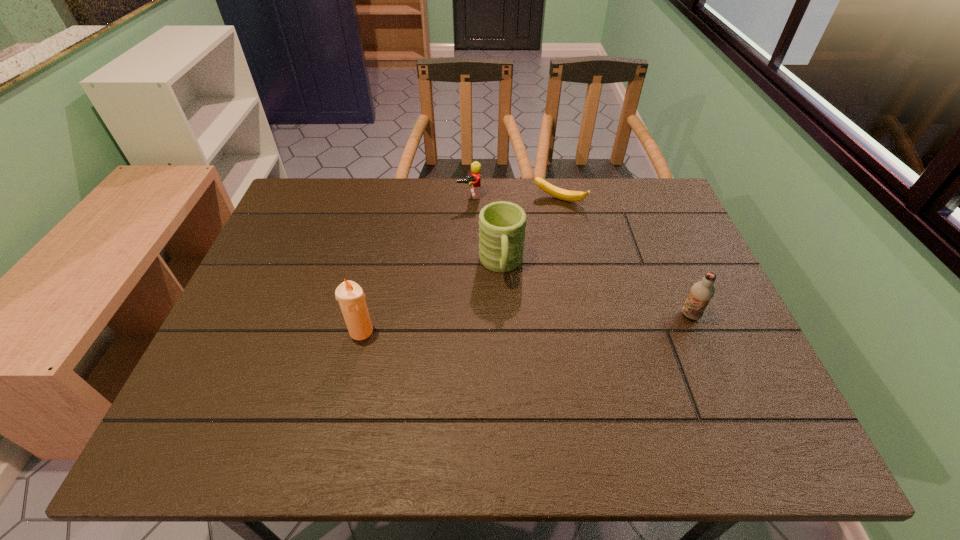
This screenshot has height=540, width=960. Identify the location of object situated at the right edge. (701, 292).

Identify the location of free space at the far edge of the desktop. The height and width of the screenshot is (540, 960). (462, 209).

This screenshot has height=540, width=960. I want to click on vacant space at the near edge of the desktop, so click(x=445, y=387).

This screenshot has height=540, width=960. I want to click on vacant space at the left edge of the desktop, so click(252, 352).

Find the location of a particular element. This screenshot has width=960, height=540. vacant space at the far left corner of the desktop is located at coordinates (315, 194).

This screenshot has height=540, width=960. Find the location of `vacant point at the far right corner`. vacant point at the far right corner is located at coordinates (647, 205).

In the image, there is a desktop. Where is `vacant space at the near right corner`? Image resolution: width=960 pixels, height=540 pixels. vacant space at the near right corner is located at coordinates (764, 396).

Identify the location of free space between the rightmost object and the candle. (x=526, y=323).

Identify the location of empty space that is in between the second shortest object and the shortest object. The image size is (960, 540). (515, 198).

At what (x,y) coordinates should I click in order to perform the action: click on free space between the chocolate milk and the Lego. Please return your answer as a coordinate pair (x, y). The image size is (960, 540). Looking at the image, I should click on (580, 255).